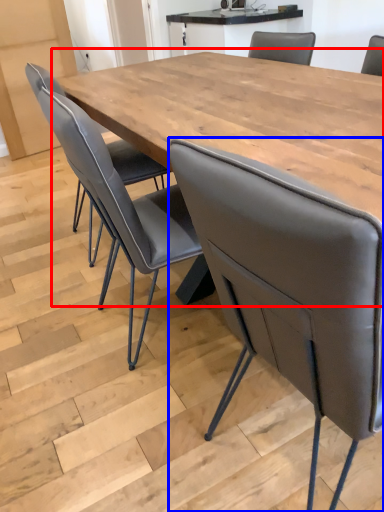
Question: Which object appears farthest to the camera in this image, table (highlighted by a red box) or chair (highlighted by a blue box)?

Choices:
 (A) table
 (B) chair

Answer: (A)